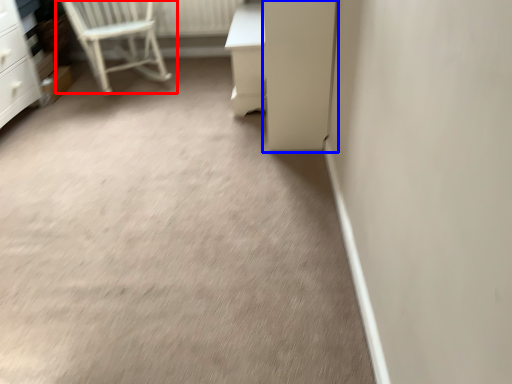
Question: Which of the following is the closest to the observer, chair (highlighted by a red box) or screen door (highlighted by a blue box)?

Choices:
 (A) chair
 (B) screen door

Answer: (B)